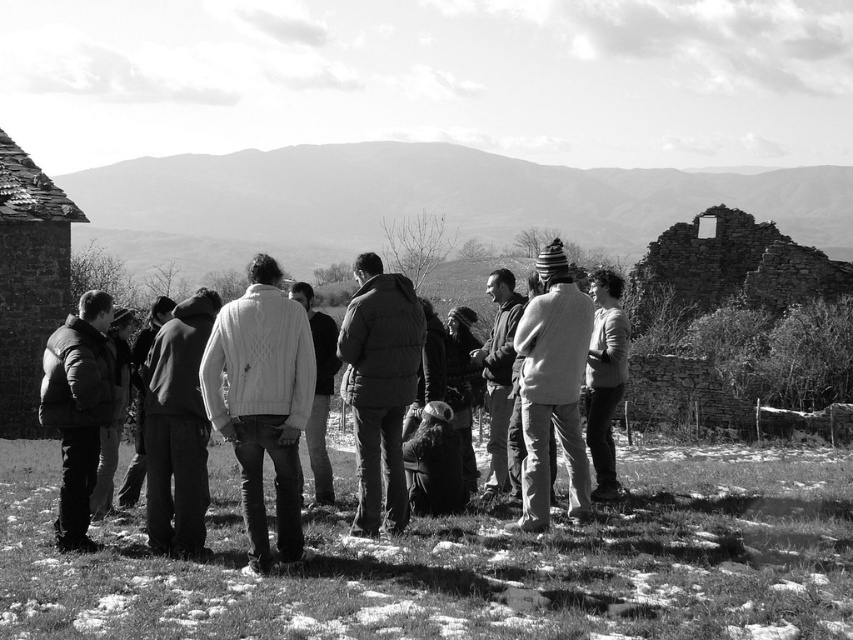
You are a photographer planning to take a group photo of the people in the scene. You notice the rustic stone hut at left and the white knitwear at center. Which object should you position closer to the camera to ensure it appears bigger in the photo?

The rustic stone hut at left is larger in size than the white knitwear at center, so positioning the rustic stone hut at left closer to the camera will make it appear even bigger in the photo.

You are a photographer trying to capture a wide shot of the group while ensuring both the rustic stone hut at left and the white knitwear at center are visible. Given their sizes, which object will appear smaller in the photo?

The white knitwear at center will appear smaller in the photo because the rustic stone hut at left is wider than it.

You are standing in the rural setting shown in the image and want to locate the white knitted sweater at center. According to the coordinates provided, where should you look to find it?

The white knitted sweater at center is located at coordinates point (262, 401), so you should look towards the position marked by those coordinates to find it.